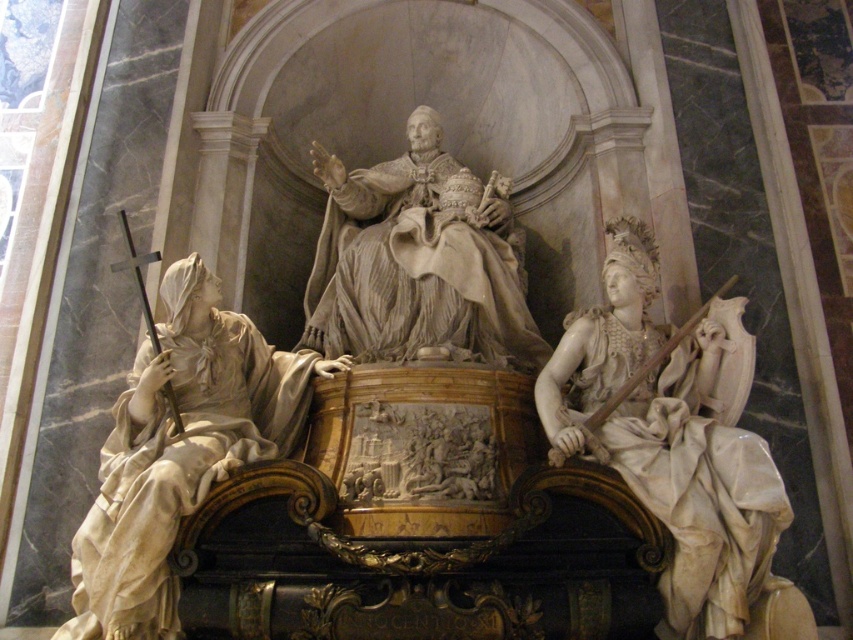
You are an art conservator assessing the placement of statues in the cathedral. The white marble statue at right and the white marble statue at center need to be inspected for structural stability. Based on their positions, which statue is positioned lower and might require a different approach for safe access?

The white marble statue at right is located below the white marble statue at center, so it is positioned lower. This means the conservator might need to use a lower platform or ladder to safely access it compared to the higher central statue.

From the picture: You are standing at the camera position and want to take a photo of the white marble statue at right. The camera has a maximum focus range of 40 meters. Will the statue be in focus?

The white marble statue at right is 43.60 meters away from the camera, which exceeds the camera maximum focus range of 40 meters. Therefore, the statue will not be in focus.

You are standing at the entrance of the cathedral and want to take a photo of the white marble statue at right. The camera you have can only focus on objects within a 0.5 unit radius. Is the point at which you are standing, point A at coordinates 0.5, 0.5, within range to capture the statue at point (679, 445)?

The distance between point A at 0.5, 0.5 and the statue at (679, 445) is approximately sqrt of squared differences in x and y coordinates. Calculating sqrt of squared difference in x is 0.198 squared plus 0.297 squared. That gives sqrt of 0.039204 plus 0.088209 equals sqrt of 0.127413, which is approximately 0.357 units. Since 0.357 is less than 0.5, the camera can focus on the statue from point A.